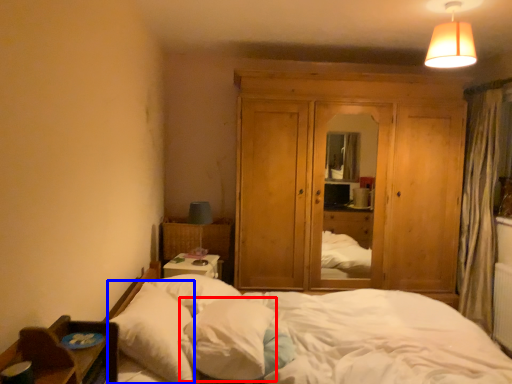
Question: Which point is further to the camera, pillow (highlighted by a red box) or pillow (highlighted by a blue box)?

Choices:
 (A) pillow
 (B) pillow

Answer: (A)